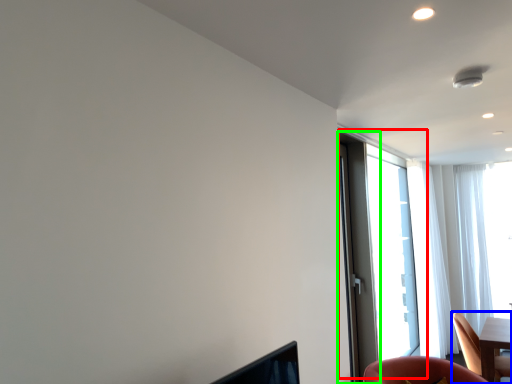
Question: Which is farther away from window (highlighted by a red box)? chair (highlighted by a blue box) or screen door (highlighted by a green box)?

Choices:
 (A) chair
 (B) screen door

Answer: (A)